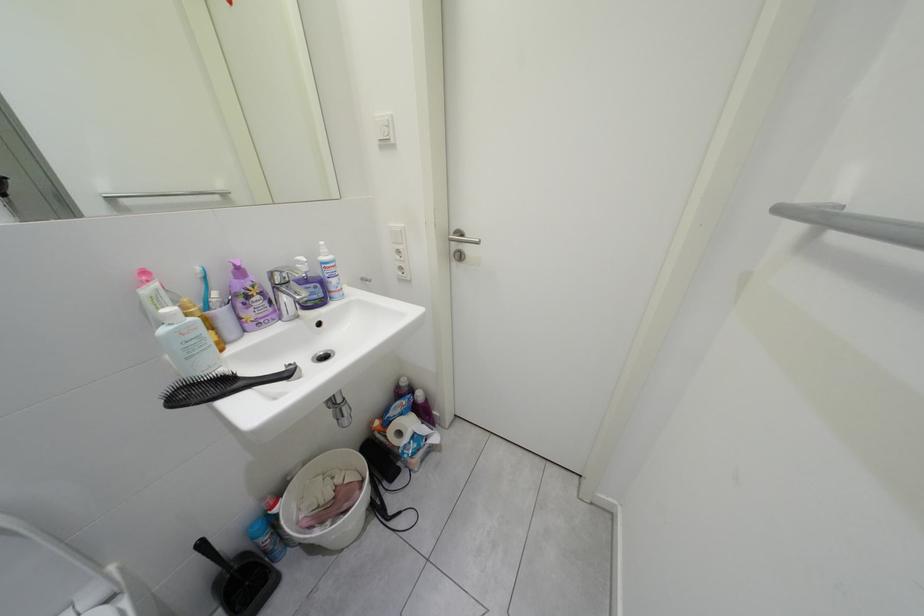
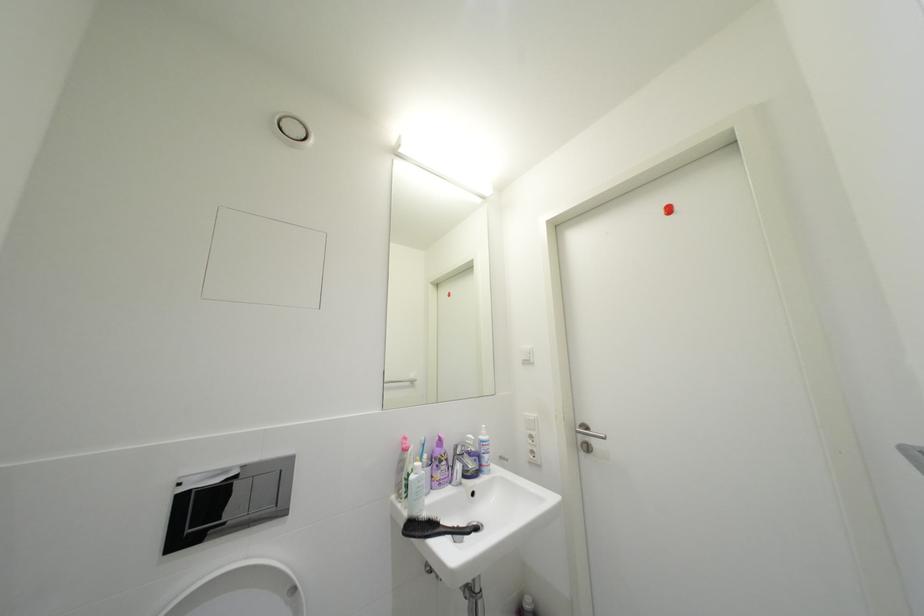
The first image is from the beginning of the video and the second image is from the end. How did the camera likely rotate when shooting the video?

The camera's rotation is toward left-up.